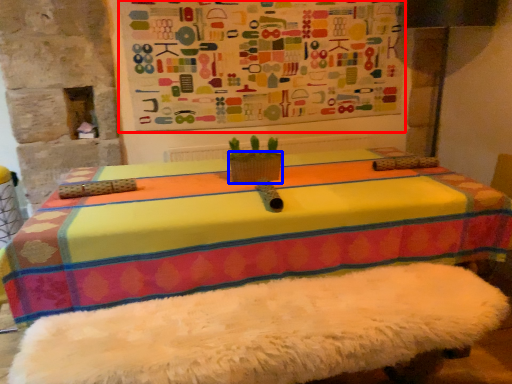
Question: Which of the following is the closest to the observer, bulletin board (highlighted by a red box) or flowerpot (highlighted by a blue box)?

Choices:
 (A) bulletin board
 (B) flowerpot

Answer: (B)